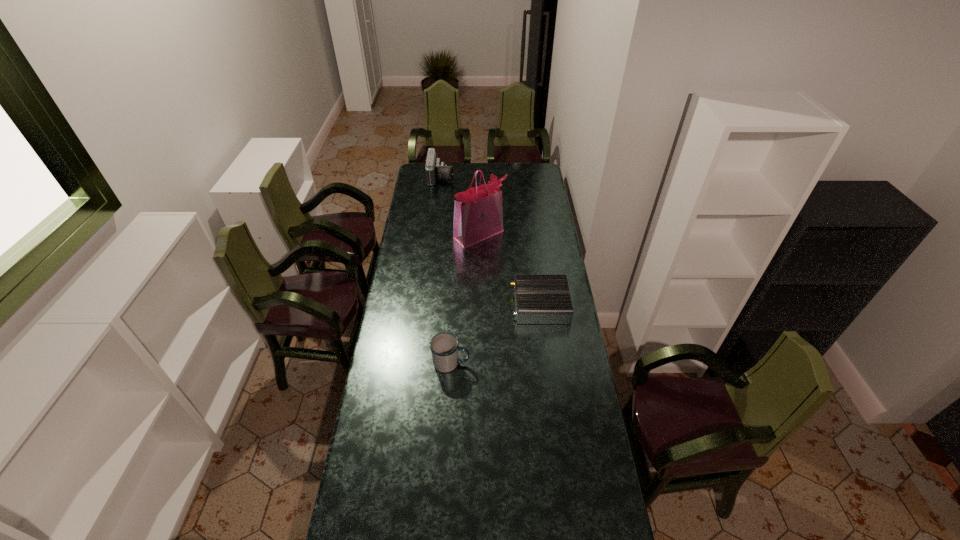
Locate an element on the screen. Image resolution: width=960 pixels, height=540 pixels. free space located 0.080m on the back panel of the shortest object is located at coordinates (493, 305).

Image resolution: width=960 pixels, height=540 pixels. What are the coordinates of `free spot located 0.070m on the back panel of the shortest object` in the screenshot? It's located at (496, 305).

The width and height of the screenshot is (960, 540). Identify the location of free location located 0.210m on the back panel of the shortest object. (466, 305).

Locate an element on the screen. object that is positioned at the far edge is located at coordinates (435, 170).

Identify the location of object that is at the left edge. (435, 170).

Where is `object situated at the right edge`? object situated at the right edge is located at coordinates (539, 299).

Where is `object that is at the far left corner`? object that is at the far left corner is located at coordinates (435, 170).

Identify the location of free space at the left edge of the desktop. (405, 354).

This screenshot has width=960, height=540. Identify the location of free space at the right edge. (534, 243).

You are a GUI agent. You are given a task and a screenshot of the screen. Output one action in this format:
    pyautogui.click(x=<x>, y=<y>)
    Task: Click on the free region at the far left corner of the desktop
    
    Given the screenshot: What is the action you would take?
    pyautogui.click(x=437, y=182)